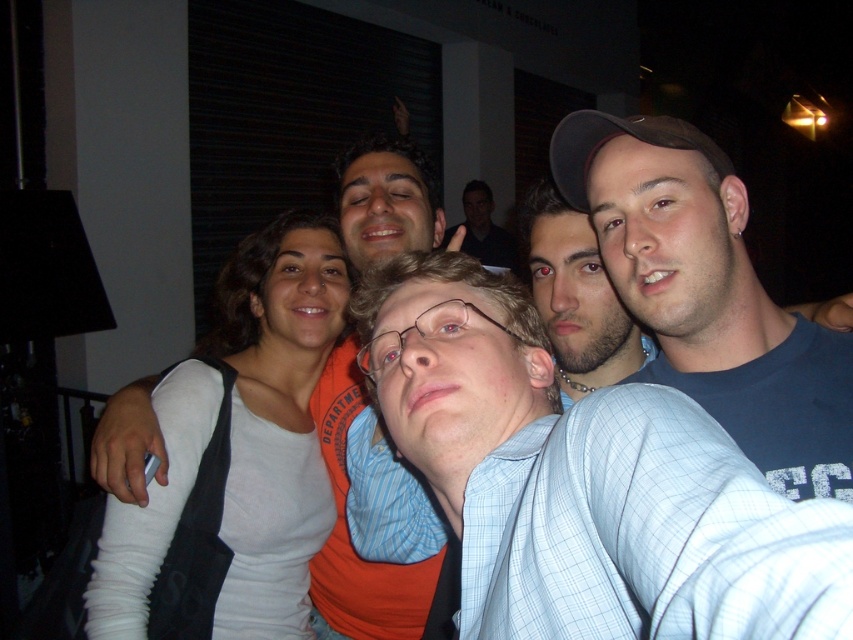
Question: Does light blue plaid shirt at center appear over smooth black shirt at center?

Choices:
 (A) no
 (B) yes

Answer: (A)

Question: Is blue t-shirt at center in front of white matte shirt at center?

Choices:
 (A) no
 (B) yes

Answer: (B)

Question: Which object appears closest to the camera in this image?

Choices:
 (A) white matte shirt at center
 (B) smooth black shirt at center
 (C) light blue plaid shirt at center

Answer: (C)

Question: From the image, what is the correct spatial relationship of light blue plaid shirt at center in relation to blue t-shirt at center?

Choices:
 (A) below
 (B) above

Answer: (A)

Question: Among these points, which one is nearest to the camera?

Choices:
 (A) (485, 260)
 (B) (550, 141)
 (C) (396, 236)

Answer: (B)

Question: Which is nearer to the white matte shirt at center?

Choices:
 (A) smooth black shirt at center
 (B) light blue plaid shirt at center
 (C) blue t-shirt at center

Answer: (C)